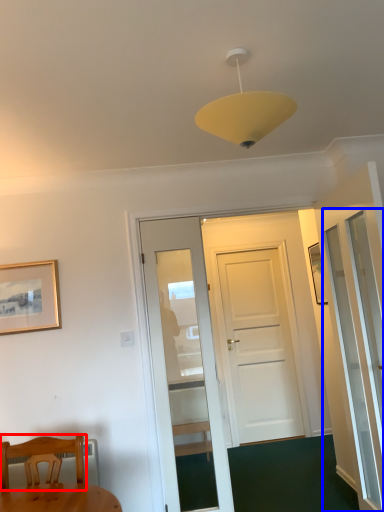
Question: Among these objects, which one is nearest to the camera, chair (highlighted by a red box) or screen door (highlighted by a blue box)?

Choices:
 (A) chair
 (B) screen door

Answer: (A)